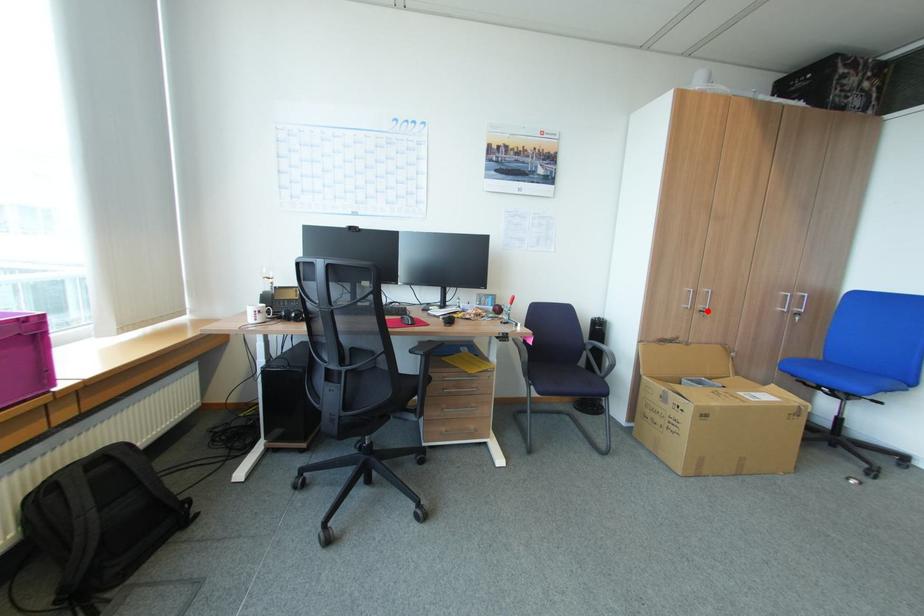
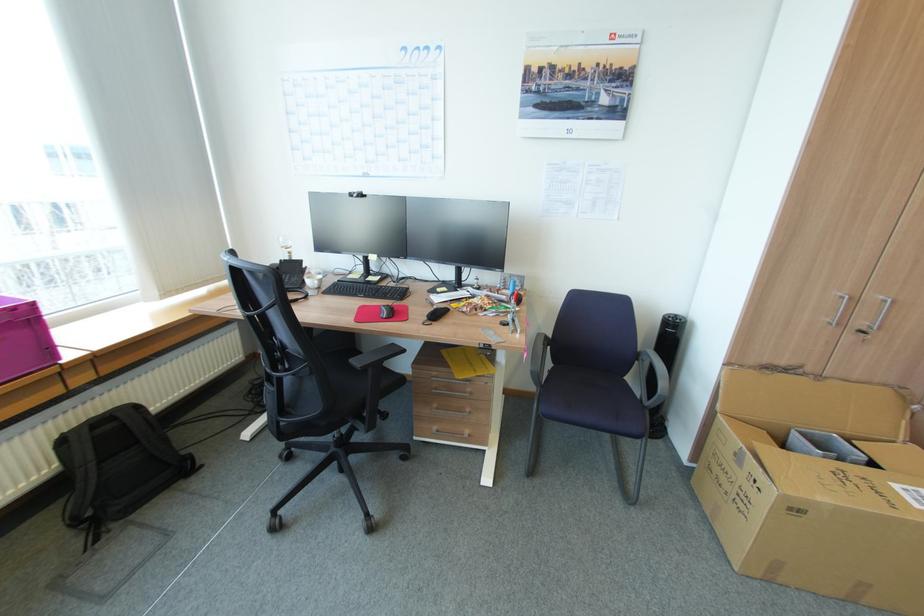
Locate, in the second image, the point that corresponds to the highlighted location in the first image.

(868, 331)